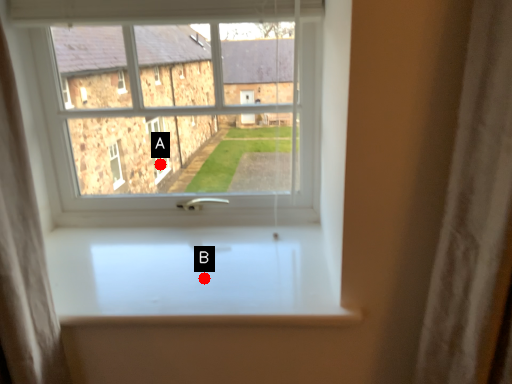
Question: Two points are circled on the image, labeled by A and B beside each circle. Which point is closer to the camera?

Choices:
 (A) A is closer
 (B) B is closer

Answer: (B)